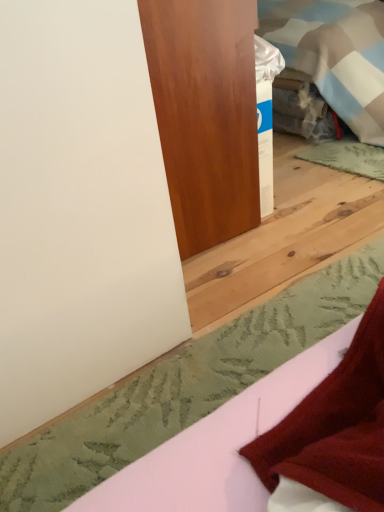
Question: Considering the positions of white matte sheet at lower right and satin wood door at upper center in the image, is white matte sheet at lower right taller or shorter than satin wood door at upper center?

Choices:
 (A) tall
 (B) short

Answer: (B)

Question: From a real-world perspective, is white matte sheet at lower right above or below satin wood door at upper center?

Choices:
 (A) above
 (B) below

Answer: (B)

Question: Considering the positions of point (100, 492) and point (185, 29), is point (100, 492) closer or farther from the camera than point (185, 29)?

Choices:
 (A) closer
 (B) farther

Answer: (A)

Question: Is satin wood door at upper center to the left or to the right of white matte sheet at lower right in the image?

Choices:
 (A) right
 (B) left

Answer: (B)

Question: Is point (223, 225) positioned closer to the camera than point (372, 407)?

Choices:
 (A) farther
 (B) closer

Answer: (A)

Question: Based on their sizes in the image, would you say satin wood door at upper center is bigger or smaller than white matte sheet at lower right?

Choices:
 (A) big
 (B) small

Answer: (A)

Question: From a real-world perspective, is satin wood door at upper center physically located above or below white matte sheet at lower right?

Choices:
 (A) above
 (B) below

Answer: (A)